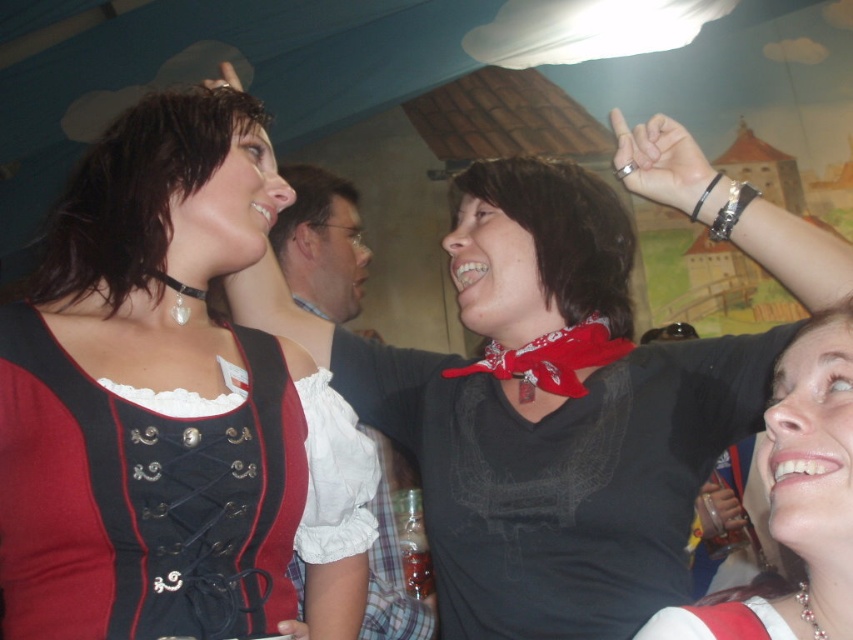
In the festive indoor scene with the castle mural, there are two people wearing accessories. The first person has a black leather choker at upper left and the other has a matte black shirt at upper right. Which accessory is positioned to the right of the other?

The matte black shirt at upper right is to the right of the black leather choker at upper left.

You are standing in the room and want to reach the red bandana at upper center without moving your feet. Can you stretch your arm to touch it?

The red bandana at upper center is 1.51 meters away from you, so if your arm can reach that distance, you can touch it.